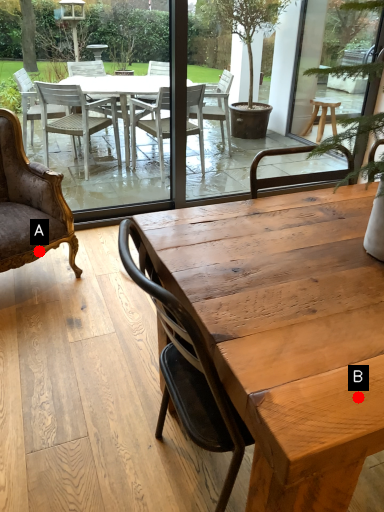
Question: Two points are circled on the image, labeled by A and B beside each circle. Among these points, which one is farthest from the camera?

Choices:
 (A) A is further
 (B) B is further

Answer: (A)